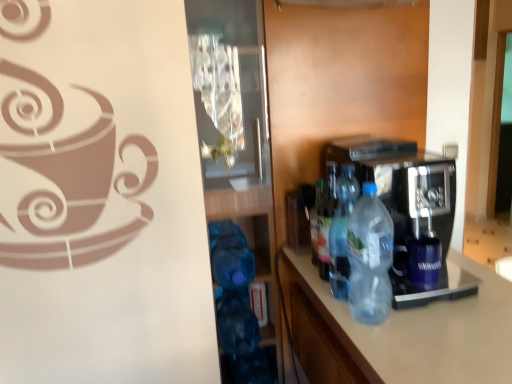
Where is `transparent plastic coffee machine at center`? This screenshot has width=512, height=384. transparent plastic coffee machine at center is located at coordinates (411, 213).

How much space does translucent plastic bottle at center, placed as the first bottle when sorted from back to front, occupy vertically?

translucent plastic bottle at center, placed as the first bottle when sorted from back to front, is 10.13 inches in height.

The height and width of the screenshot is (384, 512). I want to click on transparent glass door at center, so click(242, 127).

You are a GUI agent. You are given a task and a screenshot of the screen. Output one action in this format:
    pyautogui.click(x=<x>, y=<y>)
    Task: Click on the translucent plastic bottles at center, which is the 2th bottle from back to front
    
    Given the screenshot: What is the action you would take?
    pyautogui.click(x=342, y=231)

Image resolution: width=512 pixels, height=384 pixels. What are the coordinates of `coffee machine to the right of translucent plastic bottle at center, the third bottle positioned from the front` in the screenshot? It's located at (411, 213).

Can we say transparent plastic coffee machine at center lies outside translucent plastic bottle at center, placed as the first bottle when sorted from back to front?

Yes.

From the image's perspective, between transparent plastic coffee machine at center and translucent plastic bottle at center, the third bottle positioned from the front, which one is located above?

transparent plastic coffee machine at center.

Is transparent plastic coffee machine at center facing away from translucent plastic bottle at center, placed as the first bottle when sorted from back to front?

Yes.

Considering the sizes of objects transparent plastic coffee machine at center and transparent glass door at center in the image provided, who is wider, transparent plastic coffee machine at center or transparent glass door at center?

transparent glass door at center.

Who is more distant, transparent plastic coffee machine at center or transparent glass door at center?

transparent glass door at center is more distant.

Where is `coffee machine in front of the transparent glass door at center`? The width and height of the screenshot is (512, 384). coffee machine in front of the transparent glass door at center is located at coordinates (411, 213).

Is transparent plastic coffee machine at center inside the boundaries of transparent glass door at center, or outside?

transparent plastic coffee machine at center is spatially situated outside transparent glass door at center.

From a real-world perspective, is translucent plastic bottle at center, placed as the first bottle when sorted from back to front, physically located above or below transparent plastic coffee machine at center?

From a real-world perspective, translucent plastic bottle at center, placed as the first bottle when sorted from back to front, is physically below transparent plastic coffee machine at center.

Is translucent plastic bottle at center, the third bottle positioned from the front, placed right next to transparent plastic coffee machine at center?

No, translucent plastic bottle at center, the third bottle positioned from the front, is not beside transparent plastic coffee machine at center.

Between point (328, 273) and point (426, 183), which one is positioned in front?

The point (426, 183) is more forward.

From the image's perspective, which object appears higher, translucent plastic bottle at center, placed as the first bottle when sorted from back to front, or transparent plastic coffee machine at center?

transparent plastic coffee machine at center is shown above in the image.

Does transparent glass door at center turn towards transparent plastic coffee machine at center?

No, transparent glass door at center is not aimed at transparent plastic coffee machine at center.

Relative to transparent plastic coffee machine at center, is transparent glass door at center in front or behind?

Visually, transparent glass door at center is located behind transparent plastic coffee machine at center.

Does transparent glass door at center appear on the left side of transparent plastic coffee machine at center?

Indeed, transparent glass door at center is positioned on the left side of transparent plastic coffee machine at center.

Which of these two, transparent glass door at center or translucent plastic bottles at center, which is the 2th bottle from back to front, is bigger?

With larger size is transparent glass door at center.

Is transparent glass door at center positioned with its back to translucent plastic bottles at center, which is the 2th bottle from back to front?

No, translucent plastic bottles at center, which is the 2th bottle from back to front, is not at the back of transparent glass door at center.

Choose the correct answer: Is transparent glass door at center inside translucent plastic bottles at center, which is the 2th bottle from back to front, or outside it?

transparent glass door at center is located beyond the bounds of translucent plastic bottles at center, which is the 2th bottle from back to front.

Is transparent glass door at center beside translucent plastic bottles at center, which is the second bottle from front to back?

No, transparent glass door at center is not making contact with translucent plastic bottles at center, which is the second bottle from front to back.

From a real-world perspective, between translucent plastic bottle at center, the third bottle positioned from the front, and translucent plastic bottles at center, which is the second bottle from front to back, who is vertically higher?

From a 3D spatial view, translucent plastic bottles at center, which is the second bottle from front to back, is above.

Which is more to the right, translucent plastic bottle at center, placed as the first bottle when sorted from back to front, or translucent plastic bottles at center, which is the 2th bottle from back to front?

Positioned to the right is translucent plastic bottles at center, which is the 2th bottle from back to front.

In the scene shown: Is translucent plastic bottle at center, placed as the first bottle when sorted from back to front, not near translucent plastic bottles at center, which is the 2th bottle from back to front?

That's not correct — translucent plastic bottle at center, placed as the first bottle when sorted from back to front, is a little close to translucent plastic bottles at center, which is the 2th bottle from back to front.

Is translucent plastic bottle at center, the third bottle positioned from the front, wider or thinner than translucent plastic bottles at center, which is the second bottle from front to back?

Clearly, translucent plastic bottle at center, the third bottle positioned from the front, has less width compared to translucent plastic bottles at center, which is the second bottle from front to back.

Is translucent plastic bottles at center, which is the second bottle from front to back, oriented away from translucent plastic bottle at center, positioned as the 1th bottle in front-to-back order?

Yes, translucent plastic bottles at center, which is the second bottle from front to back,'s orientation is away from translucent plastic bottle at center, positioned as the 1th bottle in front-to-back order.

Which object is further away from the camera, translucent plastic bottles at center, which is the 2th bottle from back to front, or translucent plastic bottle at center, positioned as the 1th bottle in front-to-back order?

translucent plastic bottles at center, which is the 2th bottle from back to front.

From the image's perspective, does translucent plastic bottles at center, which is the 2th bottle from back to front, appear higher than translucent plastic bottle at center, which is the 3th bottle from back to front?

Yes.

This screenshot has width=512, height=384. Find the location of `coffee machine above the translucent plastic bottle at center, placed as the first bottle when sorted from back to front (from the image's perspective)`. coffee machine above the translucent plastic bottle at center, placed as the first bottle when sorted from back to front (from the image's perspective) is located at coordinates (411, 213).

You are a GUI agent. You are given a task and a screenshot of the screen. Output one action in this format:
    pyautogui.click(x=<x>, y=<y>)
    Task: Click on the glass door to the left of transparent plastic coffee machine at center
    The image size is (512, 384).
    Given the screenshot: What is the action you would take?
    pyautogui.click(x=242, y=127)

Estimate the real-world distances between objects in this image. Which object is further from translucent plastic bottle at center, which is the 3th bottle from back to front, translucent plastic bottles at center, which is the 2th bottle from back to front, or transparent glass door at center?

transparent glass door at center is further to translucent plastic bottle at center, which is the 3th bottle from back to front.

Looking at the image, which one is located further to transparent glass door at center, translucent plastic bottle at center, the third bottle positioned from the front, or translucent plastic bottle at center, positioned as the 1th bottle in front-to-back order?

translucent plastic bottle at center, positioned as the 1th bottle in front-to-back order, is positioned further to the anchor transparent glass door at center.

Looking at the image, which one is located further to transparent glass door at center, translucent plastic bottle at center, placed as the first bottle when sorted from back to front, or translucent plastic bottles at center, which is the 2th bottle from back to front?

Based on the image, translucent plastic bottles at center, which is the 2th bottle from back to front, appears to be further to transparent glass door at center.

Considering their positions, is transparent plastic coffee machine at center positioned closer to translucent plastic bottle at center, positioned as the 1th bottle in front-to-back order, than transparent glass door at center?

Based on the image, transparent plastic coffee machine at center appears to be nearer to translucent plastic bottle at center, positioned as the 1th bottle in front-to-back order.

Considering their positions, is translucent plastic bottle at center, placed as the first bottle when sorted from back to front, positioned closer to translucent plastic bottle at center, which is the 3th bottle from back to front, than transparent plastic coffee machine at center?

The object closer to translucent plastic bottle at center, which is the 3th bottle from back to front, is transparent plastic coffee machine at center.

Looking at the image, which one is located closer to transparent plastic coffee machine at center, transparent glass door at center or translucent plastic bottle at center, positioned as the 1th bottle in front-to-back order?

Based on the image, translucent plastic bottle at center, positioned as the 1th bottle in front-to-back order, appears to be nearer to transparent plastic coffee machine at center.

Estimate the real-world distances between objects in this image. Which object is closer to transparent plastic coffee machine at center, translucent plastic bottle at center, positioned as the 1th bottle in front-to-back order, or transparent glass door at center?

translucent plastic bottle at center, positioned as the 1th bottle in front-to-back order.

Looking at the image, which one is located further to transparent glass door at center, translucent plastic bottles at center, which is the second bottle from front to back, or translucent plastic bottle at center, the third bottle positioned from the front?

Among the two, translucent plastic bottles at center, which is the second bottle from front to back, is located further to transparent glass door at center.

Locate an element on the screen. bottle between translucent plastic bottles at center, which is the 2th bottle from back to front, and transparent plastic coffee machine at center from left to right is located at coordinates (370, 258).

Find the location of a particular element. This screenshot has height=384, width=512. bottle between translucent plastic bottle at center, positioned as the 1th bottle in front-to-back order, and translucent plastic bottle at center, the third bottle positioned from the front, along the z-axis is located at coordinates point(342,231).

Where is `bottle located between transparent glass door at center and translucent plastic bottles at center, which is the second bottle from front to back, in the left-right direction`? The height and width of the screenshot is (384, 512). bottle located between transparent glass door at center and translucent plastic bottles at center, which is the second bottle from front to back, in the left-right direction is located at coordinates (324, 221).